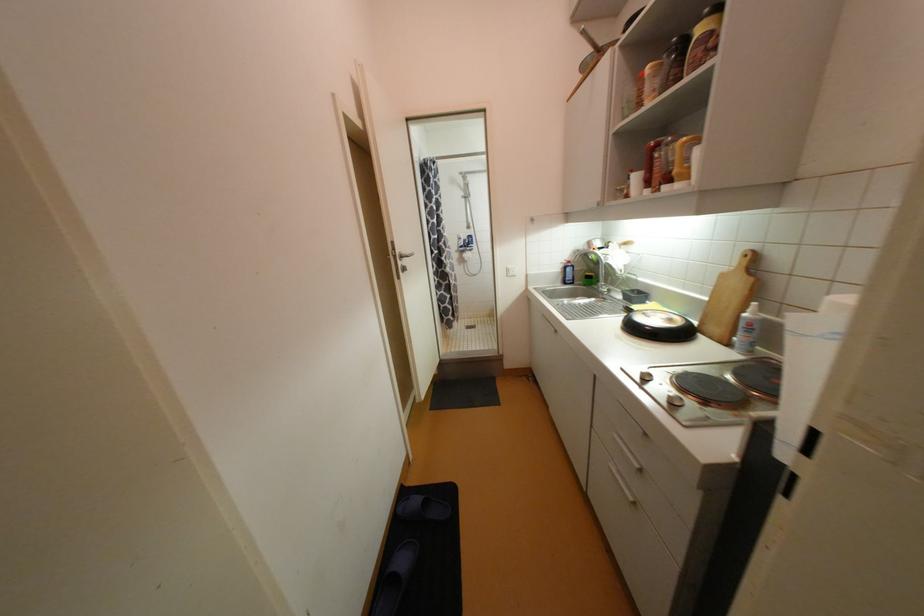
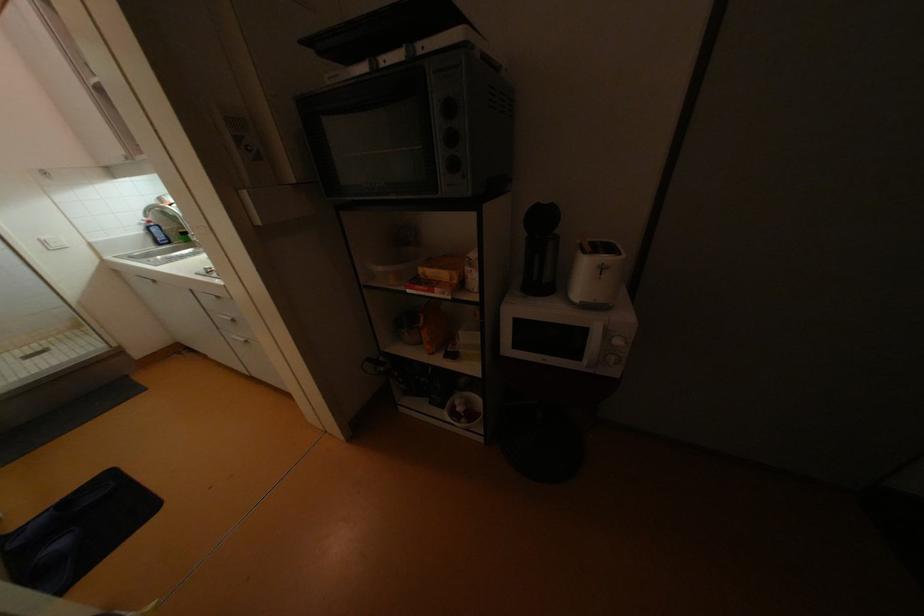
In the second image, find the point that corresponds to point 574,270 in the first image.

(160, 231)